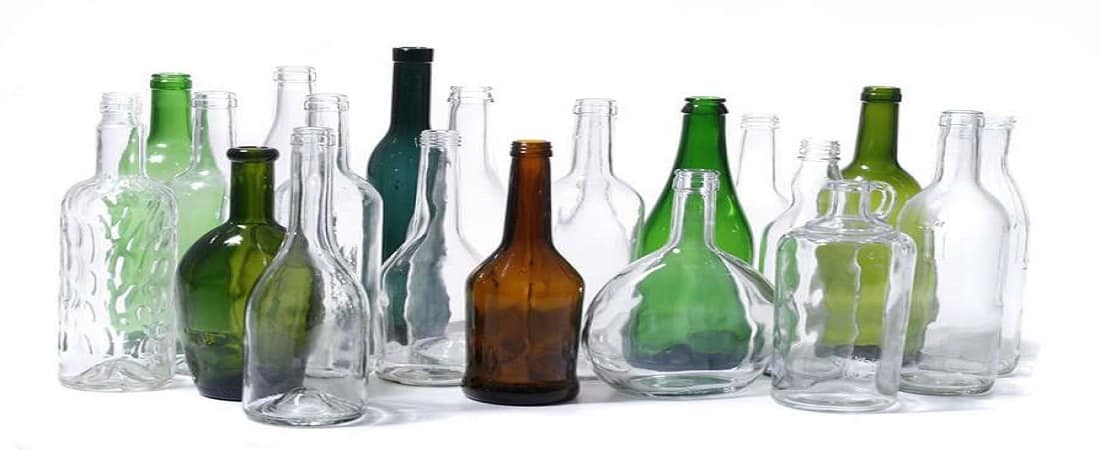
Identify the location of irregular shape bottles. The width and height of the screenshot is (1100, 450). (221, 281), (315, 360), (668, 328), (836, 317).